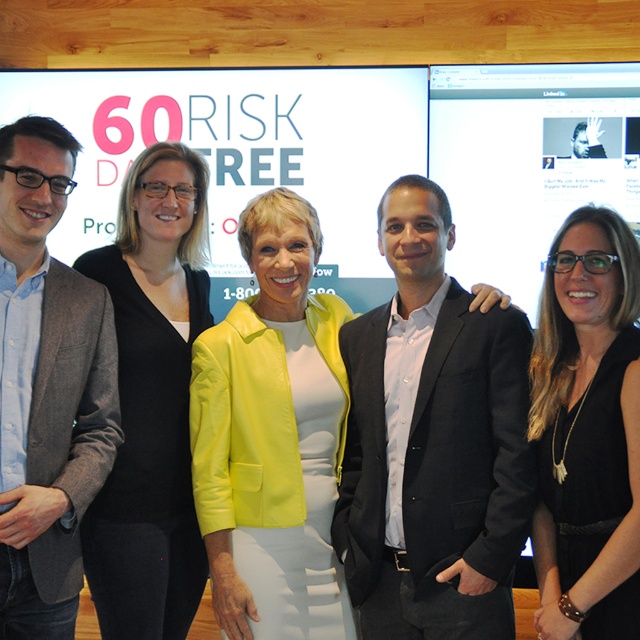
Does point (35, 604) come behind point (116, 460)?

No, it is in front of (116, 460).

You are a GUI agent. You are given a task and a screenshot of the screen. Output one action in this format:
    pyautogui.click(x=<x>, y=<y>)
    Task: Click on the matte gray blazer at left
    
    Given the screenshot: What is the action you would take?
    pyautogui.click(x=45, y=387)

I want to click on matte gray blazer at left, so click(45, 387).

Is point (243, 371) farther from camera compared to point (579, 524)?

That is True.

Image resolution: width=640 pixels, height=640 pixels. What do you see at coordinates (273, 436) in the screenshot?
I see `bright yellow leather jacket at center` at bounding box center [273, 436].

Measure the distance between bright yellow leather jacket at center and camera.

bright yellow leather jacket at center is 6.61 feet from camera.

The width and height of the screenshot is (640, 640). Identify the location of bright yellow leather jacket at center. (273, 436).

Can you confirm if black suit at center is positioned below matte gray blazer at left?

Indeed, black suit at center is positioned under matte gray blazer at left.

Is point (515, 513) in front of point (6, 256)?

No.

Identify the location of black suit at center. (433, 442).